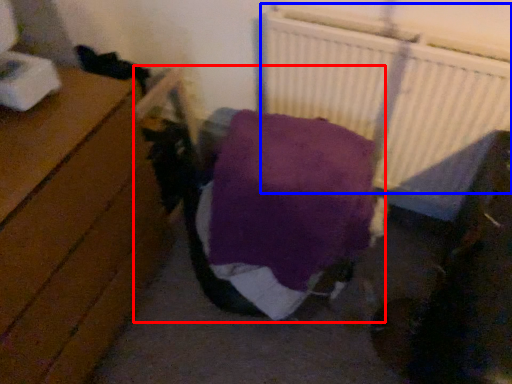
Question: Which object is closer to the camera taking this photo, bed (highlighted by a red box) or radiator (highlighted by a blue box)?

Choices:
 (A) bed
 (B) radiator

Answer: (A)